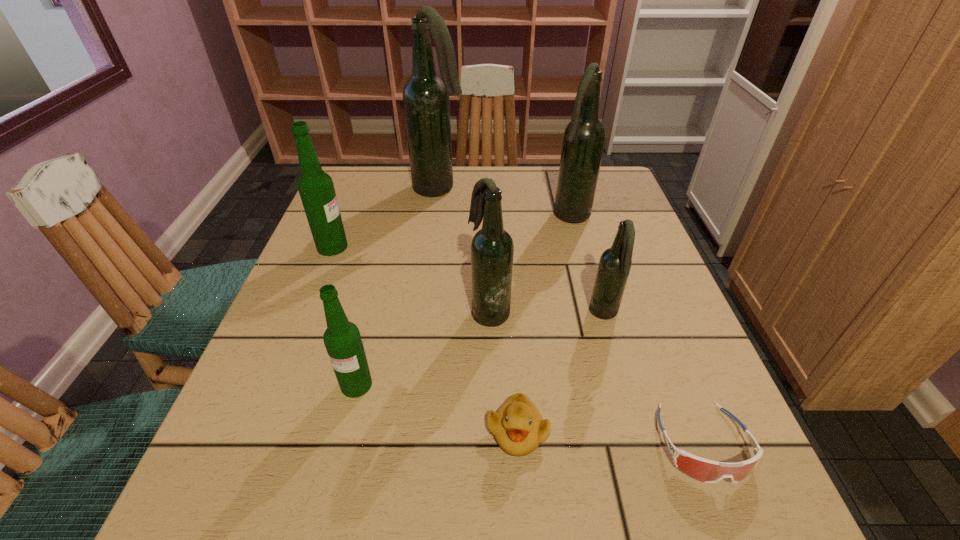
You are a GUI agent. You are given a task and a screenshot of the screen. Output one action in this format:
    pyautogui.click(x=<x>, y=<y>)
    Task: Click on the nearer green beer bottle
    This screenshot has height=540, width=960.
    Given the screenshot: What is the action you would take?
    pyautogui.click(x=342, y=339)

Where is `yellow duckling`? yellow duckling is located at coordinates (518, 427).

Find the location of `duckling`. duckling is located at coordinates (518, 427).

The width and height of the screenshot is (960, 540). Identify the location of goggles. (708, 471).

Find the location of a particular element. This screenshot has height=540, width=960. red goggles is located at coordinates (708, 471).

Locate an element on the screen. vacant space located on the front of the farthest object is located at coordinates (431, 249).

Identify the location of blank space located on the front of the third smallest dark beer bottle. The width and height of the screenshot is (960, 540). (592, 292).

You are a GUI agent. You are given a task and a screenshot of the screen. Output one action in this format:
    pyautogui.click(x=<x>, y=<y>)
    Task: Click on the vacant space located 0.200m on the label of the leftmost object
    
    Given the screenshot: What is the action you would take?
    pyautogui.click(x=432, y=247)

Where is `blank area located on the left of the second smallest dark beer bottle`? The width and height of the screenshot is (960, 540). blank area located on the left of the second smallest dark beer bottle is located at coordinates (374, 311).

Locate an element on the screen. Image resolution: width=960 pixels, height=540 pixels. vacant position located on the front of the smallest dark beer bottle is located at coordinates (659, 503).